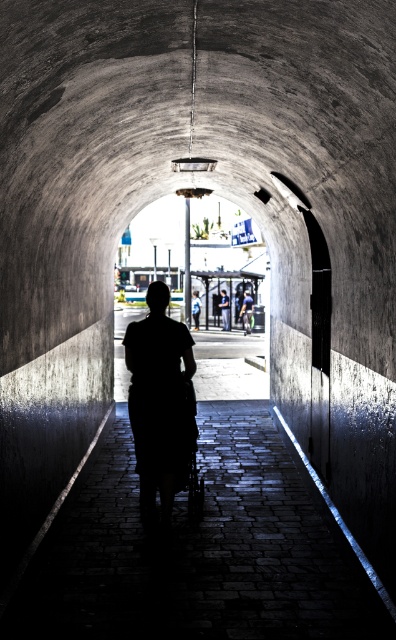
Between point (140, 346) and point (226, 296), which one is positioned in front?

Point (140, 346) is more forward.

You are a GUI agent. You are given a task and a screenshot of the screen. Output one action in this format:
    pyautogui.click(x=<x>, y=<y>)
    Task: Click on the silhouette dress at center
    
    Given the screenshot: What is the action you would take?
    pyautogui.click(x=159, y=404)

Is silhouette dress at center taller than green fabric shirt at center?

No, silhouette dress at center is not taller than green fabric shirt at center.

Is silhouette dress at center below green fabric shirt at center?

A: Yes.

Is point (184, 477) less distant than point (243, 304)?

Yes, it is in front of point (243, 304).

Find the location of `silhouette dress at center`. silhouette dress at center is located at coordinates (159, 404).

Consider the image. Is green fabric shirt at center taller than light brown leather jacket at center?

Correct, green fabric shirt at center is much taller as light brown leather jacket at center.

Can you confirm if green fabric shirt at center is positioned to the left of light brown leather jacket at center?

No, green fabric shirt at center is not to the left of light brown leather jacket at center.

Where is `green fabric shirt at center`? green fabric shirt at center is located at coordinates (247, 310).

In order to click on green fabric shirt at center in this screenshot , I will do `click(247, 310)`.